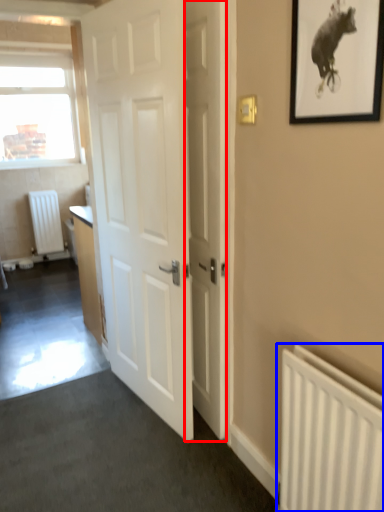
Question: Which point is closer to the camera, door (highlighted by a red box) or radiator (highlighted by a blue box)?

Choices:
 (A) door
 (B) radiator

Answer: (B)